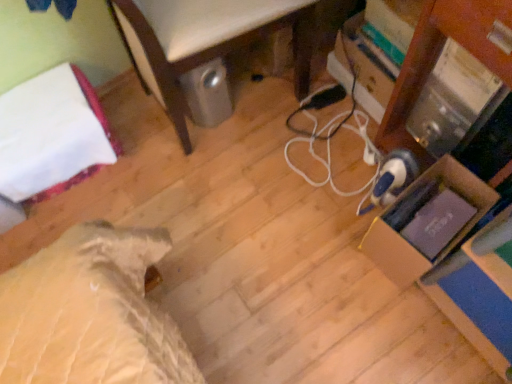
Identify the location of vacant region below metallic silver trash can at lower center (from a real-world perspective). (239, 103).